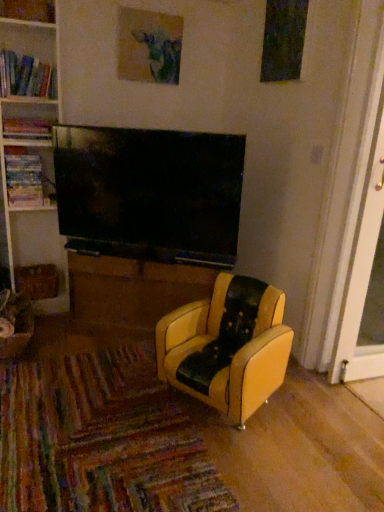
Image resolution: width=384 pixels, height=512 pixels. What are the coordinates of `empty space that is to the right of yellow leather chair at center` in the screenshot? It's located at (319, 418).